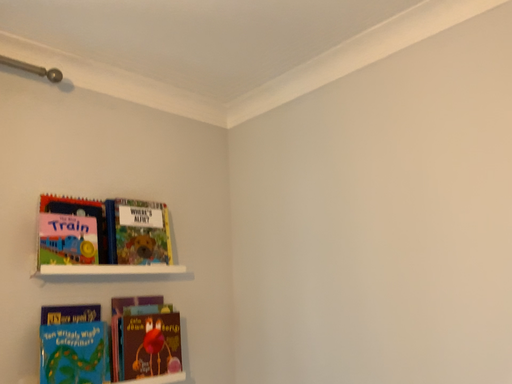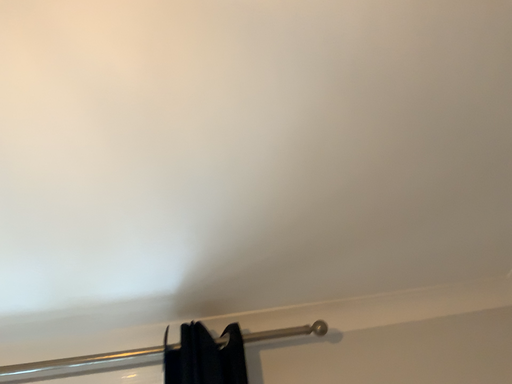
Question: Which way did the camera rotate in the video?

Choices:
 (A) rotated downward
 (B) rotated upward

Answer: (B)